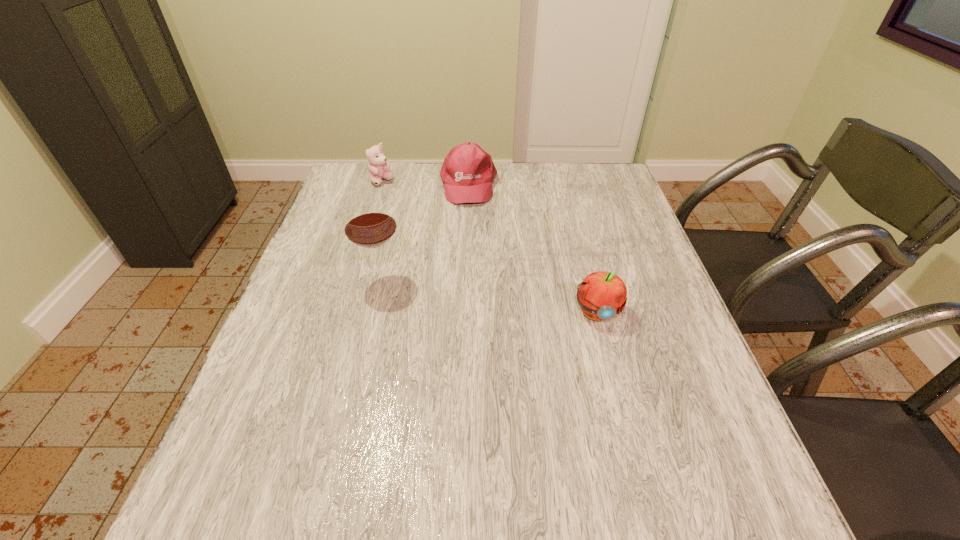
Where is `free space between the third object from left to right and the teddy bear`? free space between the third object from left to right and the teddy bear is located at coordinates (425, 183).

You are a GUI agent. You are given a task and a screenshot of the screen. Output one action in this format:
    pyautogui.click(x=<x>, y=<y>)
    Task: Click on the second closest object relative to the teddy bear
    
    Given the screenshot: What is the action you would take?
    pyautogui.click(x=369, y=223)

Find the location of a particular element. object that is the closest to the teddy bear is located at coordinates 467,173.

You are a GUI agent. You are given a task and a screenshot of the screen. Output one action in this format:
    pyautogui.click(x=<x>, y=<y>)
    Task: Click on the free space that satisfies the following two spatial constraints: 1. on the front side of the teddy bear; 2. on the left side of the wineglass
    
    Given the screenshot: What is the action you would take?
    pyautogui.click(x=350, y=281)